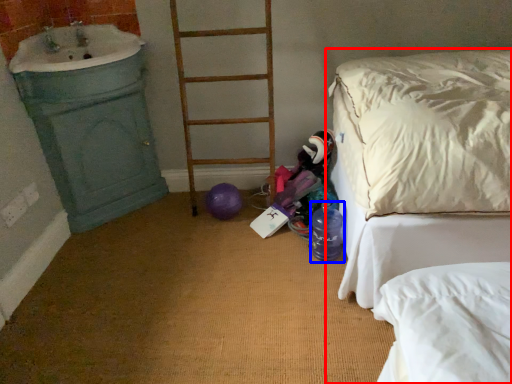
Question: Which object appears closest to the camera in this image, bed (highlighted by a red box) or bottle (highlighted by a blue box)?

Choices:
 (A) bed
 (B) bottle

Answer: (A)